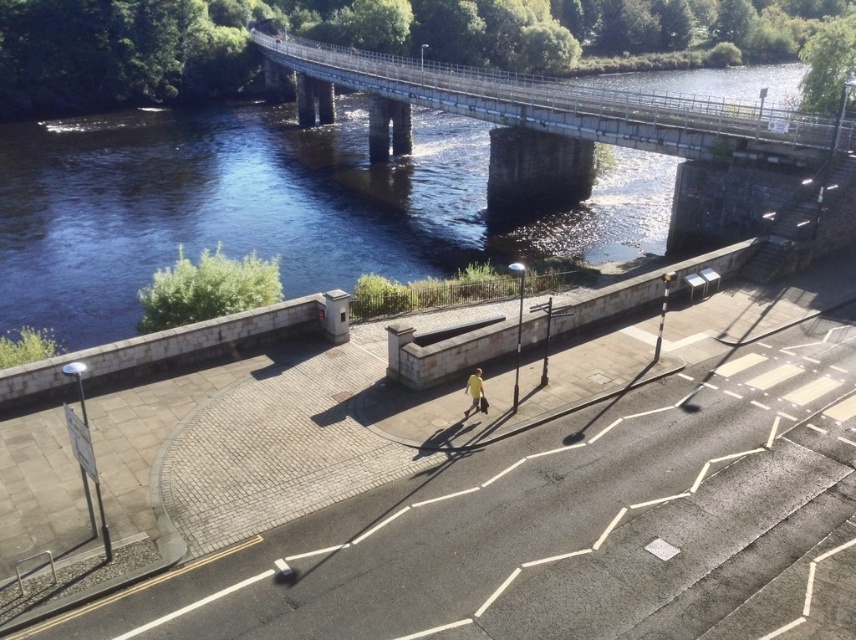
Question: Which object is the farthest from the metallic gray bridge at upper center?

Choices:
 (A) yellow fabric at center
 (B) dark blue water at upper center

Answer: (A)

Question: Considering the real-world distances, which object is farthest from the dark blue water at upper center?

Choices:
 (A) metallic gray bridge at upper center
 (B) yellow fabric at center

Answer: (B)

Question: Is dark blue water at upper center to the left of metallic gray bridge at upper center from the viewer's perspective?

Choices:
 (A) no
 (B) yes

Answer: (B)

Question: Observing the image, what is the correct spatial positioning of metallic gray bridge at upper center in reference to yellow fabric at center?

Choices:
 (A) below
 (B) above

Answer: (B)

Question: Does metallic gray bridge at upper center have a lesser width compared to yellow fabric at center?

Choices:
 (A) no
 (B) yes

Answer: (A)

Question: Which of the following is the farthest from the observer?

Choices:
 (A) (327, 257)
 (B) (312, 49)

Answer: (B)